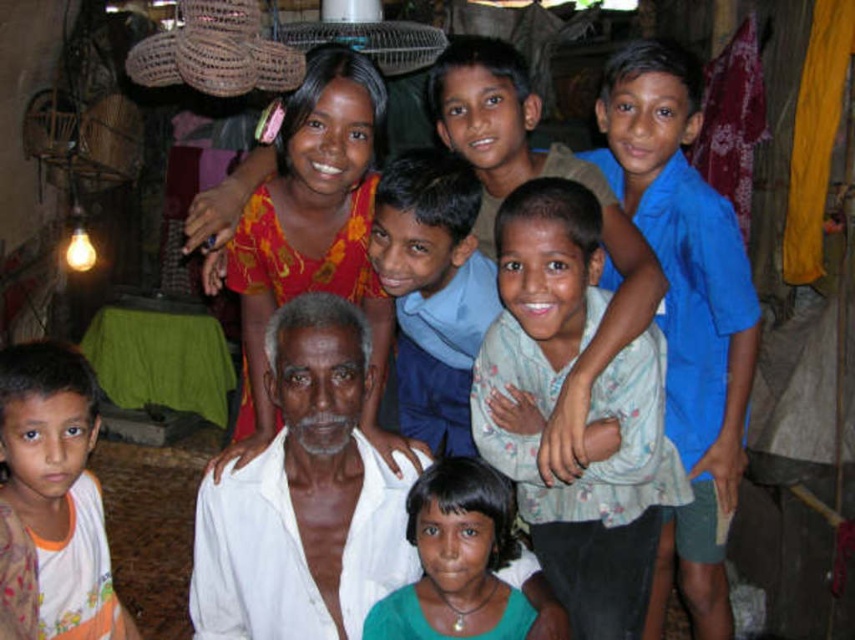
Can you confirm if white cotton shirt at center is positioned to the left of green fabric at center?

Incorrect, white cotton shirt at center is not on the left side of green fabric at center.

Who is more distant from viewer, (626, 61) or (396, 604)?

Positioned behind is point (626, 61).

Identify the location of white cotton shirt at center. (638, 262).

Between floral cotton shirt at center and white cloth at center, which one is positioned lower?

white cloth at center is lower down.

Who is more distant from viewer, [575,314] or [380,593]?

Point [380,593]

Image resolution: width=855 pixels, height=640 pixels. I want to click on floral cotton shirt at center, so click(x=588, y=412).

Between point (416, 556) and point (467, 586), which one is positioned in front?

Point (467, 586)

Is white cloth at center thinner than green fabric at center?

In fact, white cloth at center might be wider than green fabric at center.

Who is more distant from viewer, (302, 440) or (447, 545)?

Positioned behind is point (447, 545).

The height and width of the screenshot is (640, 855). In order to click on white cloth at center in this screenshot , I will do `click(304, 497)`.